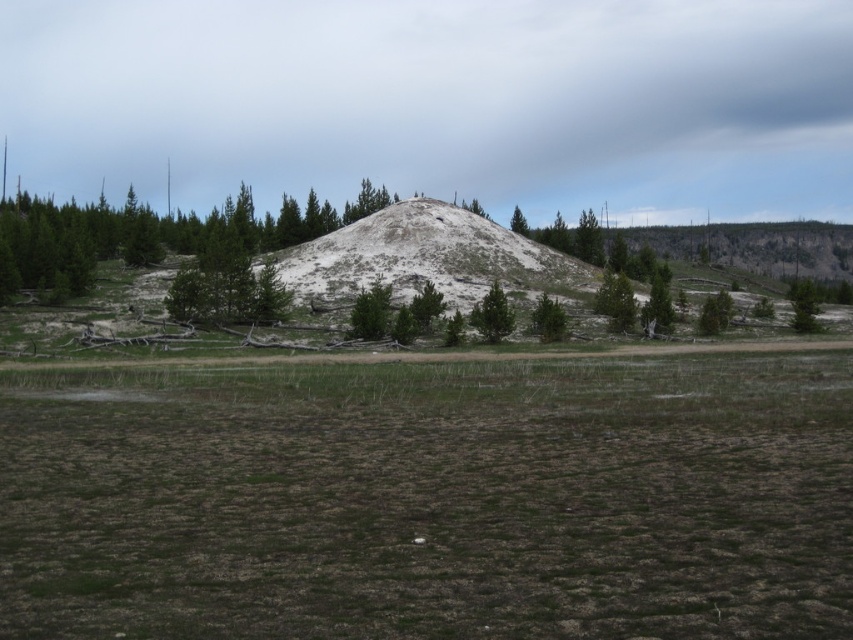
Can you confirm if green grass at center is smaller than green matte tree at center?

Incorrect, green grass at center is not smaller in size than green matte tree at center.

In the scene shown: Measure the distance from green grass at center to green matte tree at center.

green grass at center is 50.13 meters from green matte tree at center.

Does point (561, 628) lie in front of point (485, 316)?

Yes, it is in front of point (485, 316).

Identify the location of green grass at center. Image resolution: width=853 pixels, height=640 pixels. (430, 500).

Can you confirm if green matte tree at center is positioned to the right of green matte tree at upper center?

Incorrect, green matte tree at center is not on the right side of green matte tree at upper center.

How distant is green matte tree at center from green matte tree at upper center?

They are 82.70 meters apart.

Find the location of `green matte tree at center`. green matte tree at center is located at coordinates (492, 316).

Does green textured pine at left lie behind green matte tree at upper center?

That is False.

Consider the image. Can you confirm if green textured pine at left is positioned to the right of green matte tree at upper center?

No, green textured pine at left is not to the right of green matte tree at upper center.

This screenshot has width=853, height=640. I want to click on green textured pine at left, so click(x=151, y=236).

Where is `green textured pine at left`? The height and width of the screenshot is (640, 853). green textured pine at left is located at coordinates (151, 236).